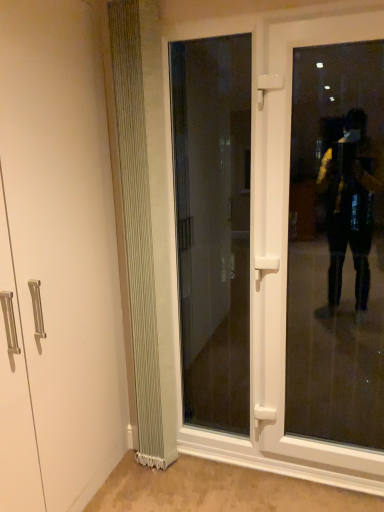
Question: Would you say transparent glass door at center, which appears as the 1th door when viewed from the left, is inside or outside white ribbed radiator at left?

Choices:
 (A) inside
 (B) outside

Answer: (B)

Question: Considering their positions, is transparent glass door at center, the 2th door positioned from the right, located in front of or behind white ribbed radiator at left?

Choices:
 (A) behind
 (B) front

Answer: (A)

Question: Which is nearer to the transparent glass door at right?

Choices:
 (A) white ribbed radiator at left
 (B) white plastic door at center, placed as the second door when sorted from left to right
 (C) transparent glass door at center, which appears as the 1th door when viewed from the left

Answer: (C)

Question: Which object is the closest to the white plastic door at center, positioned as the 1th door in right-to-left order?

Choices:
 (A) transparent glass door at center, the 2th door positioned from the right
 (B) transparent glass door at right
 (C) white ribbed radiator at left

Answer: (C)